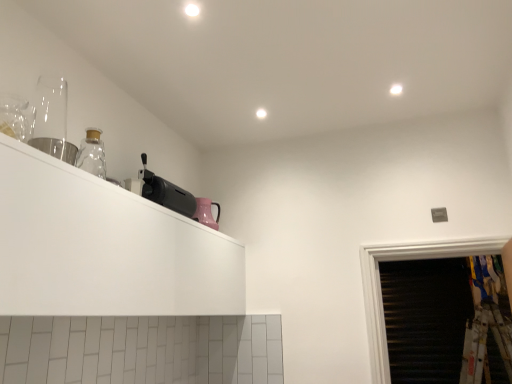
Question: From a real-world perspective, relative to pink glossy kettle at upper center, the third appliance from the front, is black plastic toaster at upper left, the 2th appliance viewed from the right, vertically above or below?

Choices:
 (A) below
 (B) above

Answer: (B)

Question: Looking at the image, does black plastic toaster at upper left, the 2th appliance viewed from the right, seem bigger or smaller compared to pink glossy kettle at upper center, the third appliance from the front?

Choices:
 (A) big
 (B) small

Answer: (A)

Question: Which of these objects is positioned closest to the white matte cabinet at upper left?

Choices:
 (A) pink glossy kettle at upper center, the 3th appliance when ordered from left to right
 (B) metallic silver cup at upper left, the third appliance from the right
 (C) black plastic toaster at upper left, the second appliance positioned from the back

Answer: (C)

Question: Which object is positioned farthest from the white matte cabinet at upper left?

Choices:
 (A) metallic silver cup at upper left, arranged as the 1th appliance when viewed from the left
 (B) pink glossy kettle at upper center, the 3th appliance when ordered from left to right
 (C) black plastic toaster at upper left, the 2th appliance viewed from the right

Answer: (B)